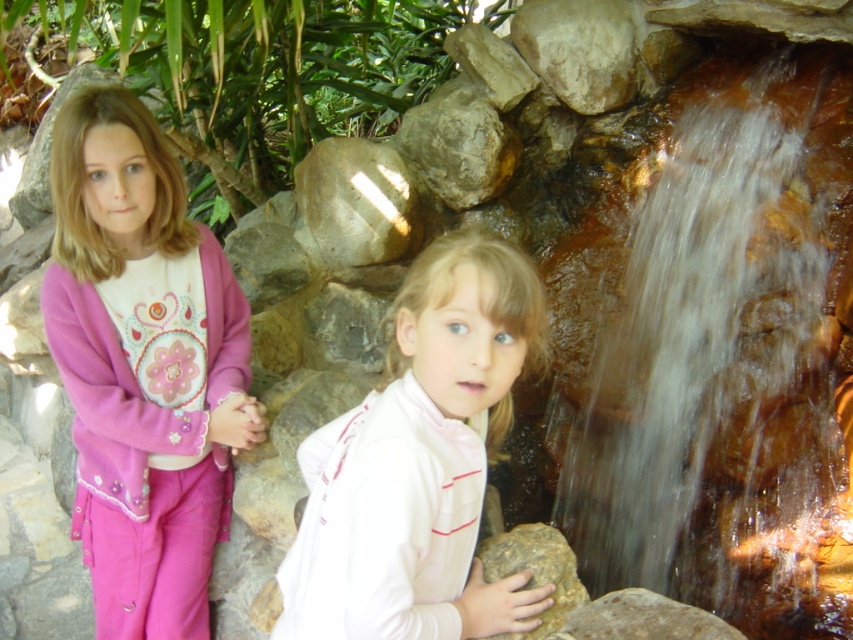
Question: Is translucent wet rock at right positioned in front of rocky brown rock at lower right?

Choices:
 (A) yes
 (B) no

Answer: (B)

Question: Is pink fleece sweater at left above rocky brown rock at lower right?

Choices:
 (A) yes
 (B) no

Answer: (A)

Question: Which point appears closest to the camera in this image?

Choices:
 (A) (575, 600)
 (B) (173, 616)
 (C) (346, 465)
 (D) (762, 202)

Answer: (C)

Question: Can you confirm if translucent wet rock at right is positioned above rocky brown rock at lower right?

Choices:
 (A) no
 (B) yes

Answer: (B)

Question: Which of the following is the closest to the observer?

Choices:
 (A) white matte jacket at center
 (B) pink fleece sweater at left
 (C) rocky brown rock at lower right
 (D) translucent wet rock at right

Answer: (A)

Question: Which point appears farthest from the camera in this image?

Choices:
 (A) (708, 376)
 (B) (555, 570)
 (C) (457, 312)

Answer: (A)